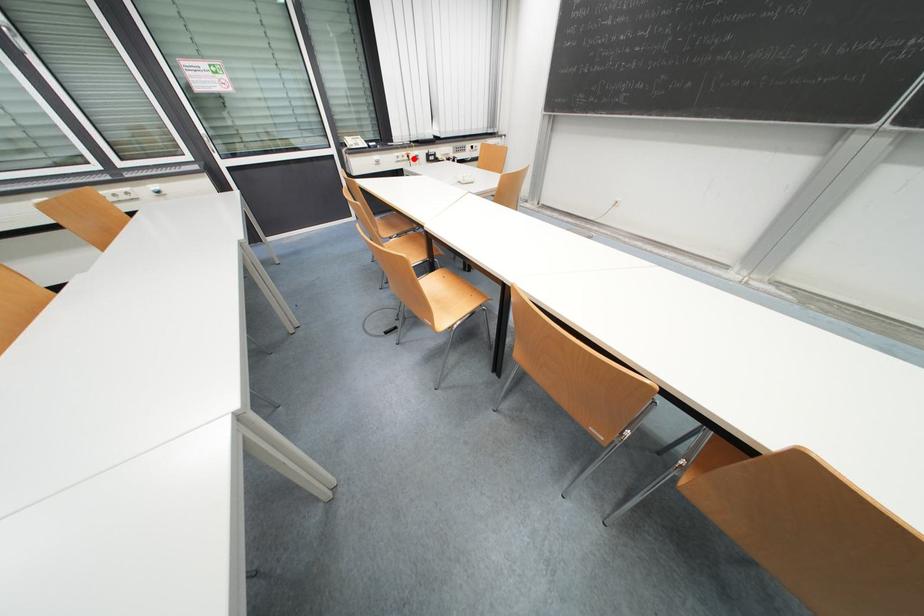
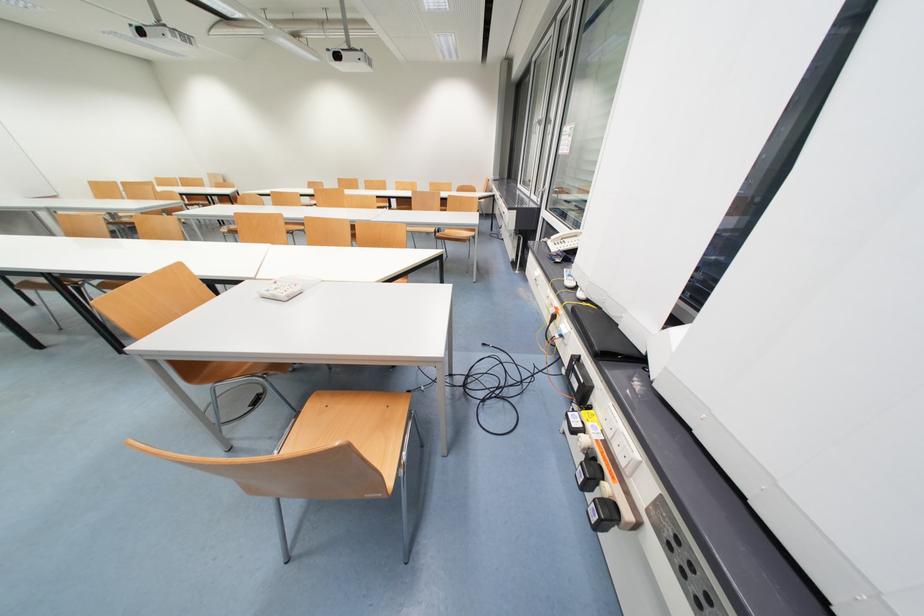
Where in the second image is the point corresponding to the highlighted location from the first image?

(560, 318)